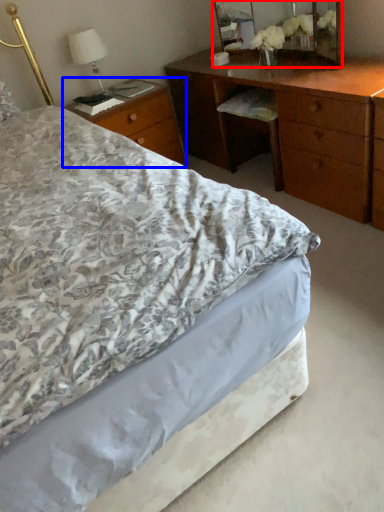
Question: Which object appears farthest to the camera in this image, mirror (highlighted by a red box) or nightstand (highlighted by a blue box)?

Choices:
 (A) mirror
 (B) nightstand

Answer: (B)